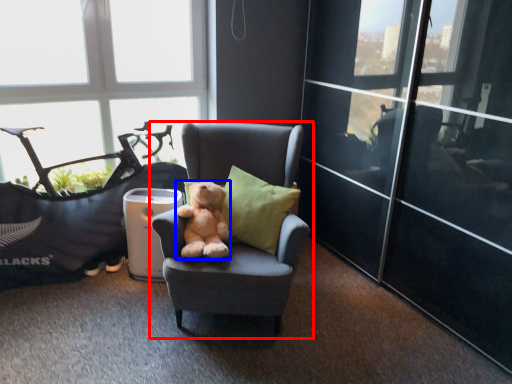
Question: Which of the following is the closest to the observer, chair (highlighted by a red box) or teddy bear (highlighted by a blue box)?

Choices:
 (A) chair
 (B) teddy bear

Answer: (A)